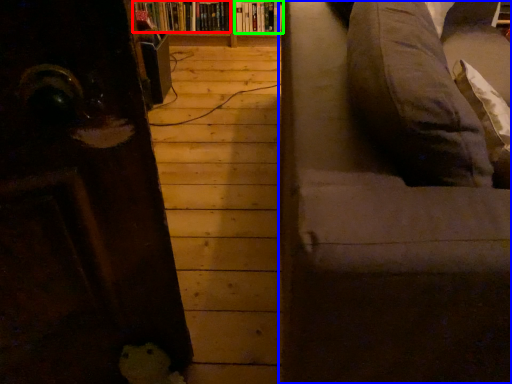
Question: Which object is positioned closest to book (highlighted by a red box)? Select from studio couch (highlighted by a blue box) and book (highlighted by a green box).

Choices:
 (A) studio couch
 (B) book

Answer: (B)